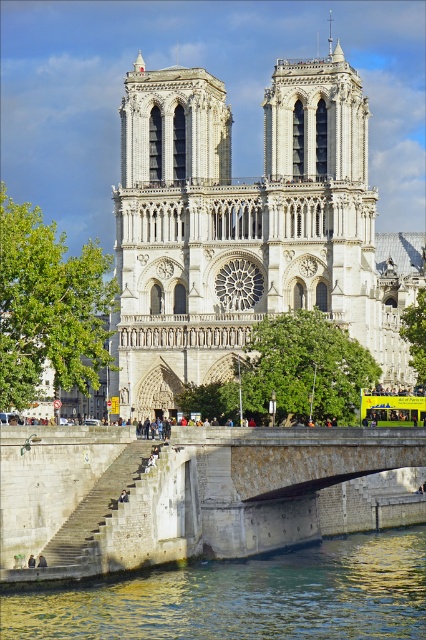
Question: Which of the following is the closest to the observer?

Choices:
 (A) pos(291,561)
 (B) pos(362,417)

Answer: (A)

Question: Does white stone cathedral at center appear on the left side of yellow-green plastic bus at center?

Choices:
 (A) yes
 (B) no

Answer: (A)

Question: Estimate the real-world distances between objects in this image. Which object is farther from the greenish water at lower center?

Choices:
 (A) yellow-green plastic bus at center
 (B) stone bridge at lower center
 (C) white stone cathedral at center

Answer: (C)

Question: Can you confirm if stone bridge at lower center is positioned to the left of yellow-green plastic bus at center?

Choices:
 (A) no
 (B) yes

Answer: (B)

Question: Can you confirm if white stone cathedral at center is positioned to the left of yellow-green plastic bus at center?

Choices:
 (A) no
 (B) yes

Answer: (B)

Question: Which of the following is the closest to the observer?

Choices:
 (A) (386, 413)
 (B) (97, 438)

Answer: (B)